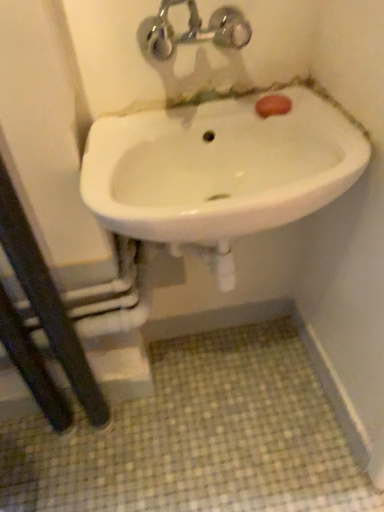
The image size is (384, 512). I want to click on white glossy sink at center, so click(x=212, y=127).

Describe the element at coordinates (212, 127) in the screenshot. The image size is (384, 512). I see `white glossy sink at center` at that location.

At what (x,y) coordinates should I click in order to perform the action: click on white glossy sink at center. Please return your answer as a coordinate pair (x, y). The width and height of the screenshot is (384, 512). Looking at the image, I should click on (212, 127).